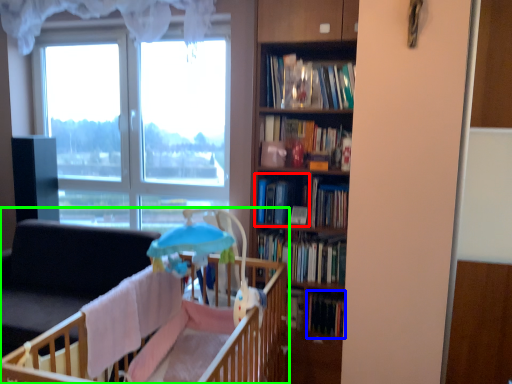
Question: Based on their relative distances, which object is nearer to book (highlighted by a red box)? Choose from book (highlighted by a blue box) and infant bed (highlighted by a green box).

Choices:
 (A) book
 (B) infant bed

Answer: (B)